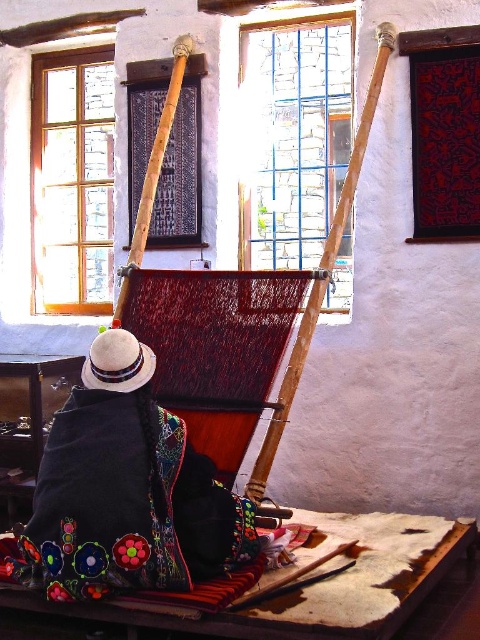
Question: Which point is farther to the camera?

Choices:
 (A) pos(90,381)
 (B) pos(134,426)

Answer: (A)

Question: Which point is closer to the camera?

Choices:
 (A) embroidered fabric at lower left
 (B) white felt hat at lower left

Answer: (A)

Question: Considering the relative positions of embroidered fabric at lower left and white felt hat at lower left in the image provided, where is embroidered fabric at lower left located with respect to white felt hat at lower left?

Choices:
 (A) above
 (B) below

Answer: (B)

Question: Is embroidered fabric at lower left thinner than white felt hat at lower left?

Choices:
 (A) no
 (B) yes

Answer: (A)

Question: Which object appears farthest from the camera in this image?

Choices:
 (A) white felt hat at lower left
 (B) embroidered fabric at lower left

Answer: (A)

Question: Can you confirm if embroidered fabric at lower left is positioned below white felt hat at lower left?

Choices:
 (A) no
 (B) yes

Answer: (B)